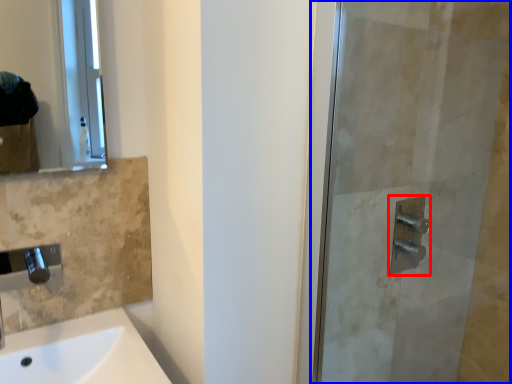
Question: Which of the following is the farthest to the observer, shower (highlighted by a red box) or screen door (highlighted by a blue box)?

Choices:
 (A) shower
 (B) screen door

Answer: (A)